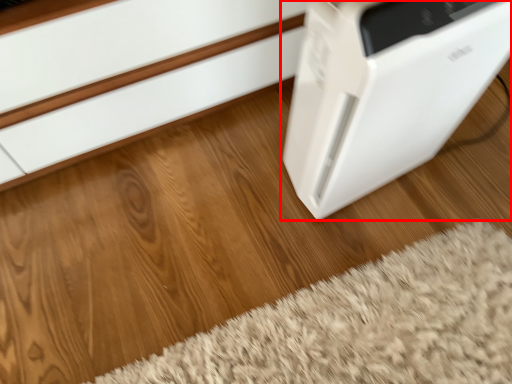
Question: From the image's perspective, considering the relative positions of home appliance (annotated by the red box) and doormat in the image provided, where is home appliance (annotated by the red box) located with respect to the staircase?

Choices:
 (A) above
 (B) below

Answer: (A)